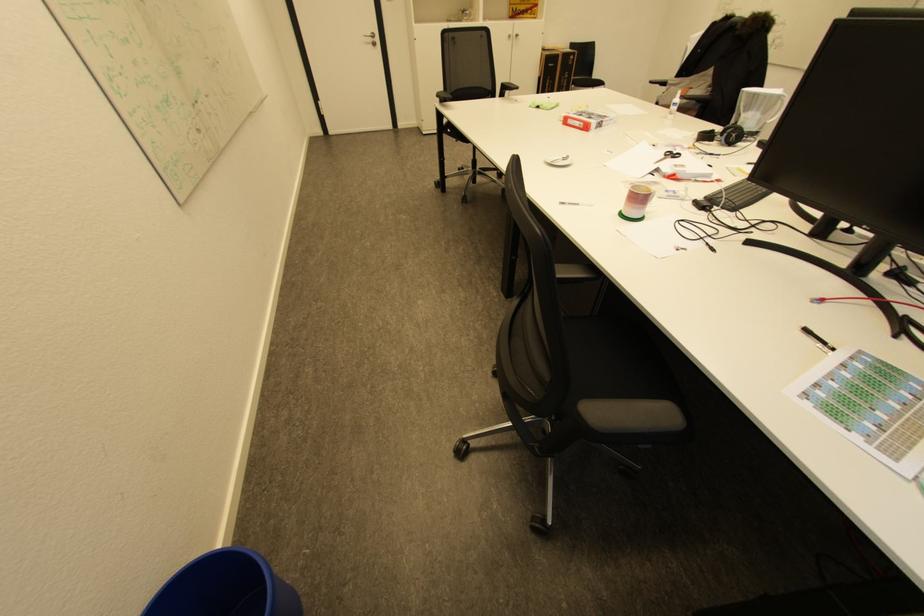
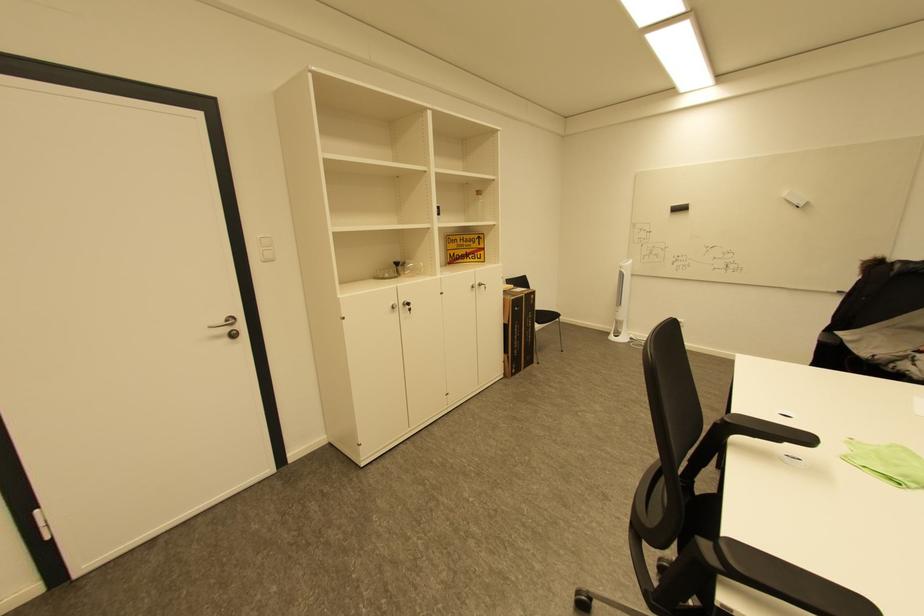
In the second image, find the point that corresponds to pixel 378 41 in the first image.

(233, 330)